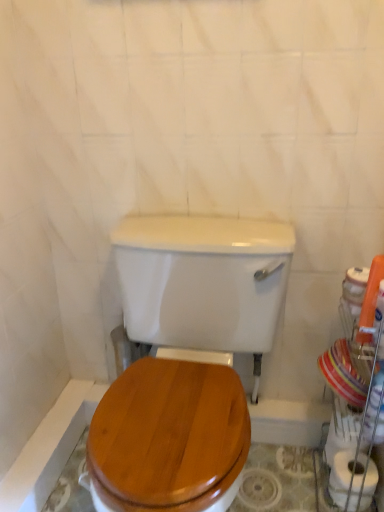
What do you see at coordinates (355, 341) in the screenshot?
I see `white glossy porcelain at right` at bounding box center [355, 341].

Find the location of a particular element. This screenshot has width=384, height=512. wooden toilet seat at center is located at coordinates (203, 284).

At what (x,y) coordinates should I click in order to perform the action: click on white matte toilet paper at lower right. Please return your answer as a coordinate pair (x, y). The image size is (384, 512). Looking at the image, I should click on (341, 476).

Is white glossy porcelain at right taller or shorter than white matte toilet paper at lower right?

In the image, white glossy porcelain at right appears to be taller than white matte toilet paper at lower right.

Based on the photo, from the image's perspective, is white glossy porcelain at right beneath white matte toilet paper at lower right?

No.

Measure the distance between white glossy porcelain at right and white matte toilet paper at lower right.

white glossy porcelain at right is 23.18 centimeters away from white matte toilet paper at lower right.

In the image, is white glossy porcelain at right positioned in front of or behind white matte toilet paper at lower right?

white glossy porcelain at right is positioned closer to the viewer than white matte toilet paper at lower right.

Based on their sizes in the image, would you say white matte toilet paper at lower right is bigger or smaller than wooden toilet seat at center?

In the image, white matte toilet paper at lower right appears to be smaller than wooden toilet seat at center.

Could you tell me if white matte toilet paper at lower right is turned towards wooden toilet seat at center?

Yes, white matte toilet paper at lower right is aimed at wooden toilet seat at center.

Can you see white matte toilet paper at lower right touching wooden toilet seat at center?

white matte toilet paper at lower right is not next to wooden toilet seat at center, and they're not touching.

What's the angular difference between white matte toilet paper at lower right and wooden toilet seat at center's facing directions?

The angle between the facing direction of white matte toilet paper at lower right and the facing direction of wooden toilet seat at center is 92.9 degrees.

From the image's perspective, who appears lower, white matte toilet paper at lower right or white glossy porcelain at right?

From the image's view, white matte toilet paper at lower right is below.

Where is `porcelain on the left side of white matte toilet paper at lower right`? porcelain on the left side of white matte toilet paper at lower right is located at coordinates (355, 341).

Who is taller, white matte toilet paper at lower right or white glossy porcelain at right?

With more height is white glossy porcelain at right.

Which is more to the left, white matte toilet paper at lower right or white glossy porcelain at right?

white glossy porcelain at right is more to the left.

From a real-world perspective, is white glossy porcelain at right physically above wooden toilet seat at center?

Incorrect, from a real-world perspective, white glossy porcelain at right is lower than wooden toilet seat at center.

Find the location of a particular element. The image size is (384, 512). porcelain on the right side of wooden toilet seat at center is located at coordinates (355, 341).

Would you say wooden toilet seat at center is part of white glossy porcelain at right's contents?

Definitely not — wooden toilet seat at center is not inside white glossy porcelain at right.

Would you say white glossy porcelain at right is part of wooden toilet seat at center's contents?

No, white glossy porcelain at right is located outside of wooden toilet seat at center.

Does wooden toilet seat at center have a smaller size compared to white glossy porcelain at right?

Incorrect, wooden toilet seat at center is not smaller in size than white glossy porcelain at right.

Can you see wooden toilet seat at center touching white glossy porcelain at right?

No, wooden toilet seat at center is not making contact with white glossy porcelain at right.

Could you tell me if wooden toilet seat at center is facing white glossy porcelain at right?

No, wooden toilet seat at center is not turned towards white glossy porcelain at right.

How different are the orientations of wooden toilet seat at center and white matte toilet paper at lower right in degrees?

The angular difference between wooden toilet seat at center and white matte toilet paper at lower right is 92.9 degrees.

Looking at this image, is wooden toilet seat at center facing towards white matte toilet paper at lower right?

No, wooden toilet seat at center is not oriented towards white matte toilet paper at lower right.

Between point (139, 252) and point (349, 480), which one is positioned in front?

Point (139, 252)

Would you say wooden toilet seat at center is a long distance from white matte toilet paper at lower right?

No.

At what (x,y) coordinates should I click in order to perform the action: click on porcelain above the white matte toilet paper at lower right (from the image's perspective). Please return your answer as a coordinate pair (x, y). Looking at the image, I should click on (355, 341).

Locate an element on the screen. This screenshot has width=384, height=512. toilet paper on the right of wooden toilet seat at center is located at coordinates (341, 476).

Based on their spatial positions, is wooden toilet seat at center or white glossy porcelain at right further from white matte toilet paper at lower right?

The object further to white matte toilet paper at lower right is wooden toilet seat at center.

Which object lies nearer to the anchor point wooden toilet seat at center, white matte toilet paper at lower right or white glossy porcelain at right?

white glossy porcelain at right is closer to wooden toilet seat at center.

Considering their positions, is wooden toilet seat at center positioned closer to white glossy porcelain at right than white matte toilet paper at lower right?

The object closer to white glossy porcelain at right is white matte toilet paper at lower right.

Considering their positions, is white matte toilet paper at lower right positioned closer to white glossy porcelain at right than wooden toilet seat at center?

The object closer to white glossy porcelain at right is white matte toilet paper at lower right.

Which object lies nearer to the anchor point white matte toilet paper at lower right, white glossy porcelain at right or wooden toilet seat at center?

white glossy porcelain at right.

Looking at the image, which one is located closer to wooden toilet seat at center, white glossy porcelain at right or white matte toilet paper at lower right?

white glossy porcelain at right is closer to wooden toilet seat at center.

The width and height of the screenshot is (384, 512). I want to click on porcelain located between wooden toilet seat at center and white matte toilet paper at lower right in the left-right direction, so click(x=355, y=341).